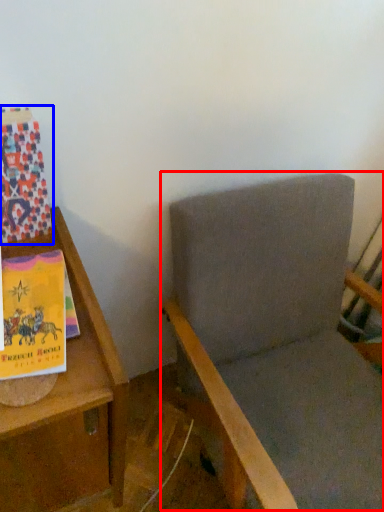
Question: Which point is further to the camera, rocking chair (highlighted by a red box) or paperback book (highlighted by a blue box)?

Choices:
 (A) rocking chair
 (B) paperback book

Answer: (B)